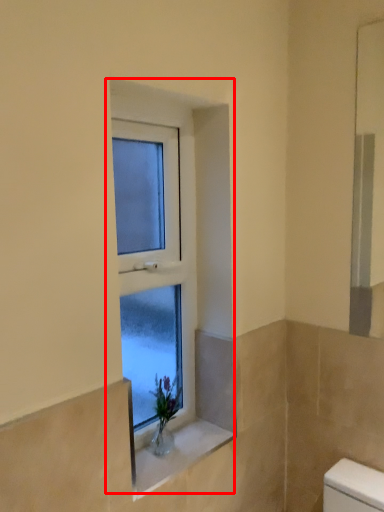
Question: Considering the relative positions of window (annotated by the red box) and window sill in the image provided, where is window (annotated by the red box) located with respect to the staircase?

Choices:
 (A) right
 (B) left

Answer: (B)